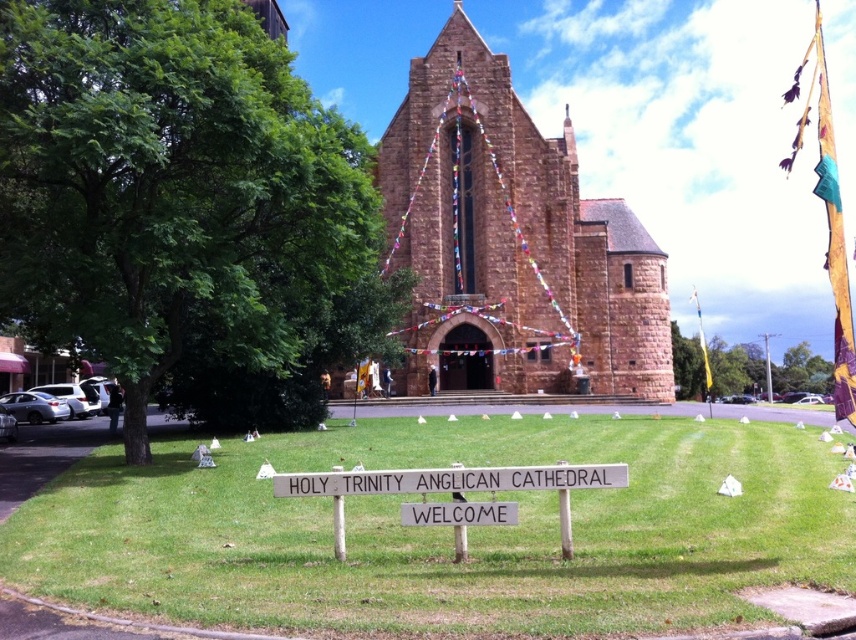
Is point (284, 547) positioned before point (476, 289)?

Yes, it is in front of point (476, 289).

Between green grass at center and brown stone church at center, which one appears on the right side from the viewer's perspective?

brown stone church at center

Which is in front, point (40, 579) or point (583, 260)?

Point (40, 579) is in front.

Image resolution: width=856 pixels, height=640 pixels. In order to click on green grass at center in this screenshot , I will do `click(444, 531)`.

Does white wooden sign at center have a greater width compared to green leafy tree at upper center?

Yes.

Can you confirm if white wooden sign at center is positioned to the right of green leafy tree at upper center?

In fact, white wooden sign at center is to the left of green leafy tree at upper center.

Where is `white wooden sign at center`? white wooden sign at center is located at coordinates (452, 486).

The height and width of the screenshot is (640, 856). I want to click on white wooden sign at center, so click(x=452, y=486).

In the scene shown: Who is positioned more to the right, green grass at center or green leafy tree at upper center?

From the viewer's perspective, green leafy tree at upper center appears more on the right side.

Is point (318, 497) positioned before point (740, 371)?

Yes.

Between point (412, 586) and point (676, 374), which one is positioned behind?

Positioned behind is point (676, 374).

This screenshot has height=640, width=856. I want to click on green grass at center, so click(x=444, y=531).